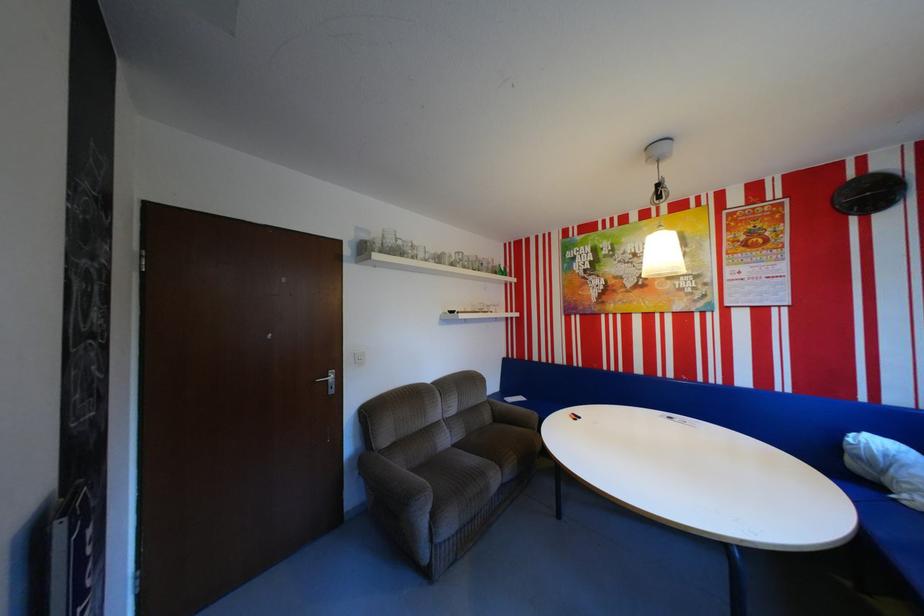
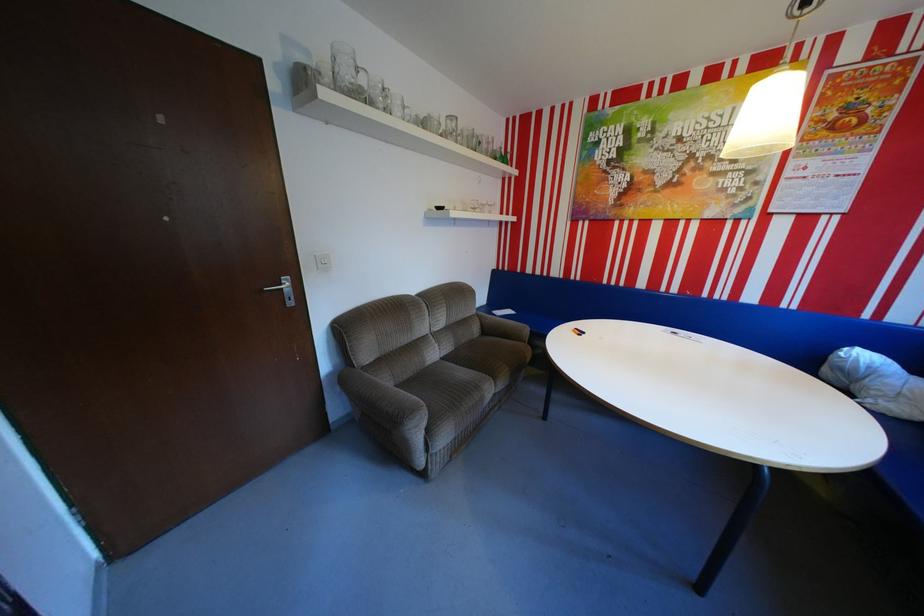
Where in the second image is the point corresponding to point 475,265 from the first image?

(468, 140)